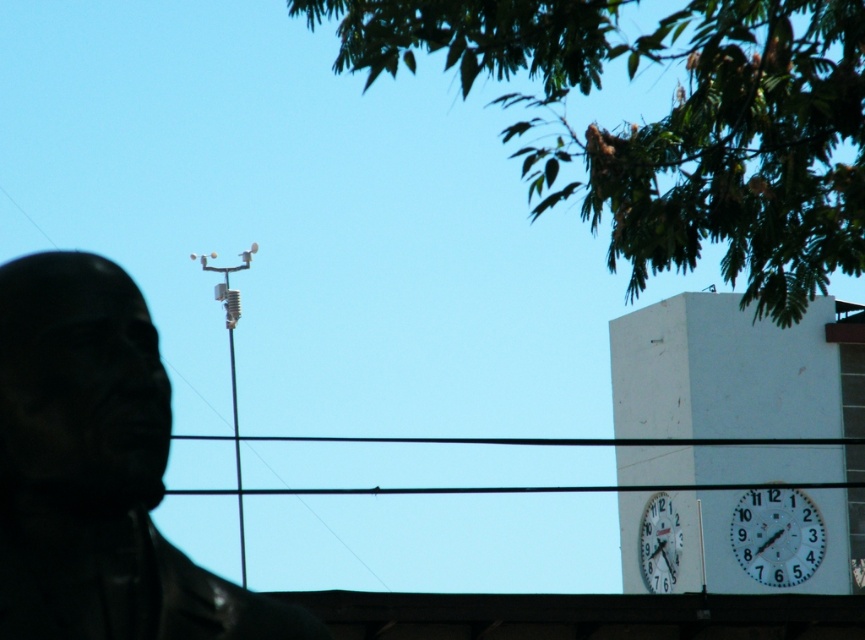
Can you confirm if white glossy clock at right is smaller than white glossy clock at upper right?

Yes, white glossy clock at right is smaller than white glossy clock at upper right.

Is white glossy clock at right behind white glossy clock at upper right?

No, white glossy clock at right is in front of white glossy clock at upper right.

Where is `white glossy clock at right`? The height and width of the screenshot is (640, 865). white glossy clock at right is located at coordinates (777, 536).

Based on the photo, does black matte statue at upper left appear on the left side of white glossy clock at right?

Indeed, black matte statue at upper left is positioned on the left side of white glossy clock at right.

Between black matte statue at upper left and white glossy clock at right, which one appears on the right side from the viewer's perspective?

white glossy clock at right

Is point (143, 467) positioned behind point (758, 516)?

No.

Locate an element on the screen. This screenshot has width=865, height=640. black matte statue at upper left is located at coordinates (97, 470).

Who is positioned more to the left, green leafy tree at upper center or white glossy clock at upper right?

green leafy tree at upper center is more to the left.

Looking at this image, is green leafy tree at upper center positioned at the back of white glossy clock at upper right?

No, green leafy tree at upper center is closer to the viewer.

Does point (652, 48) come closer to viewer compared to point (671, 586)?

Yes.

The width and height of the screenshot is (865, 640). I want to click on green leafy tree at upper center, so click(670, 124).